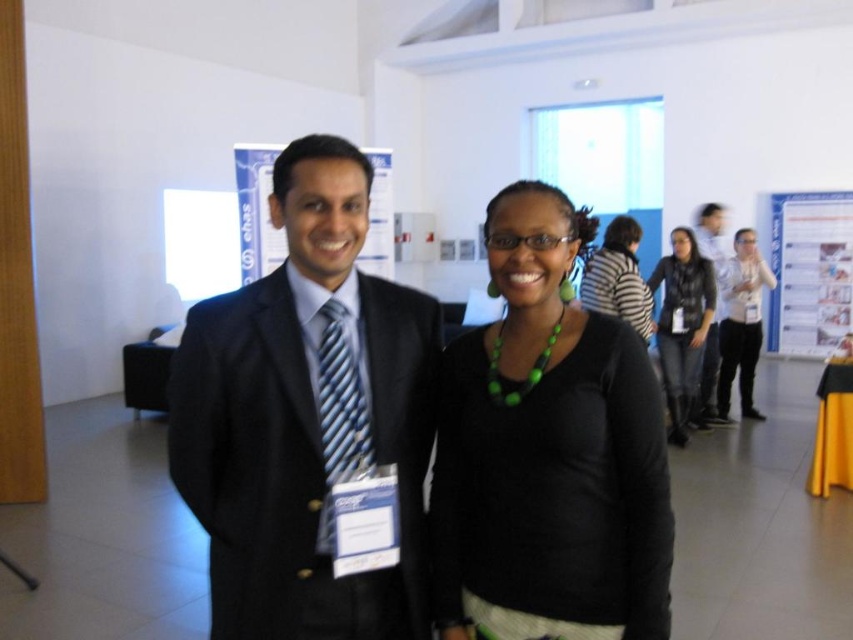
You are standing in the conference hall and want to take a photo of both the point at coordinates point (x=618, y=483) and point (x=712, y=385). Which point should you focus on first to ensure both are in clear view?

You should focus on point (x=618, y=483) first because it is closer to the camera than point (x=712, y=385). This ensures that both points are within the camera focus range.

Based on the photo, you are organizing a fashion show and need to arrange two jackets displayed at the center of the stage. The black matte jacket at center and the black leather jacket at center must be arranged according to their positions in the original image. Which jacket should be placed to the left?

The black matte jacket at center should be placed to the left because in the original image, the black matte jacket at center is positioned on the left side of the black leather jacket at center.